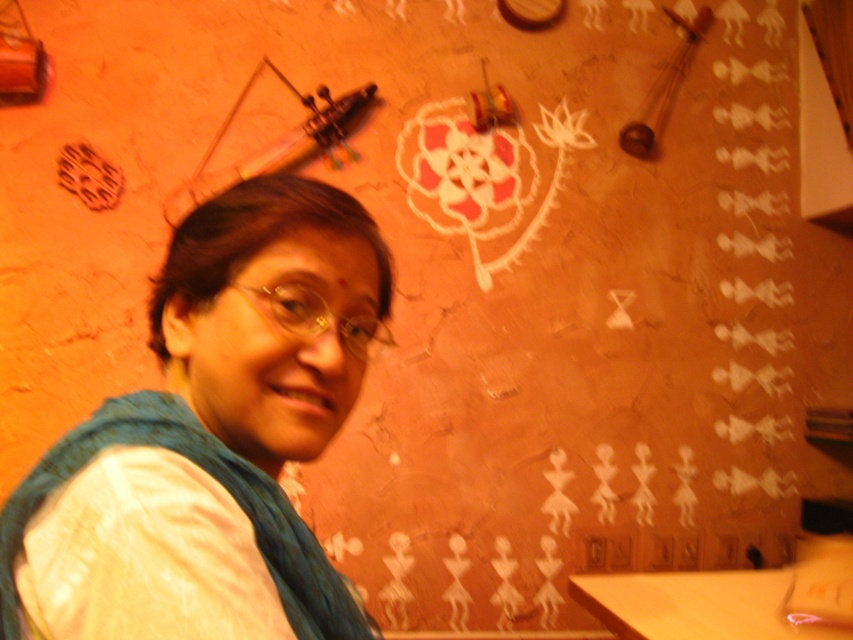
You are an interior designer looking at the image. You need to determine the relative positions of the blue fabric scarf at upper left and the wooden table at lower right. Which object is located to the left of the other?

The blue fabric scarf at upper left is positioned on the left side of wooden table at lower right.

You are standing in the room described in the scene. There is a point at coordinates [212,438]. What is located at this point?

At point [212,438] lies white fabric at center.